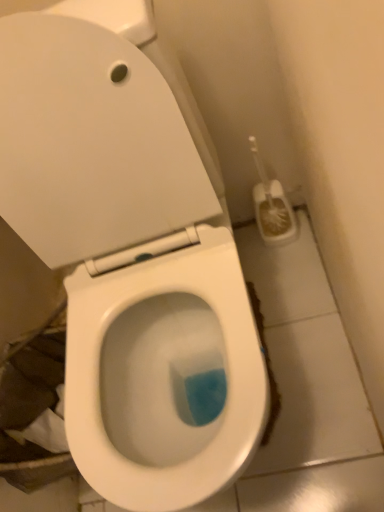
Question: Should I look upward or downward to see white plastic toilet brush at right?

Choices:
 (A) up
 (B) down

Answer: (A)

Question: Considering the relative sizes of white glossy toilet at center and white plastic toilet brush at right in the image provided, is white glossy toilet at center smaller than white plastic toilet brush at right?

Choices:
 (A) yes
 (B) no

Answer: (B)

Question: From the image's perspective, is white glossy toilet at center below white plastic toilet brush at right?

Choices:
 (A) no
 (B) yes

Answer: (B)

Question: Is white glossy toilet at center turned away from white plastic toilet brush at right?

Choices:
 (A) no
 (B) yes

Answer: (A)

Question: From a real-world perspective, does white glossy toilet at center sit lower than white plastic toilet brush at right?

Choices:
 (A) no
 (B) yes

Answer: (A)

Question: Can you confirm if white glossy toilet at center is wider than white plastic toilet brush at right?

Choices:
 (A) yes
 (B) no

Answer: (A)

Question: Does white glossy toilet at center have a greater height compared to white plastic toilet brush at right?

Choices:
 (A) no
 (B) yes

Answer: (B)

Question: Is white plastic toilet brush at right directly adjacent to white glossy toilet at center?

Choices:
 (A) no
 (B) yes

Answer: (A)

Question: Are white plastic toilet brush at right and white glossy toilet at center far apart?

Choices:
 (A) yes
 (B) no

Answer: (B)

Question: Is white glossy toilet at center inside white plastic toilet brush at right?

Choices:
 (A) no
 (B) yes

Answer: (A)

Question: From a real-world perspective, is white plastic toilet brush at right physically below white glossy toilet at center?

Choices:
 (A) no
 (B) yes

Answer: (B)

Question: Is white plastic toilet brush at right at the left side of white glossy toilet at center?

Choices:
 (A) yes
 (B) no

Answer: (B)

Question: From the image's perspective, is white plastic toilet brush at right on white glossy toilet at center?

Choices:
 (A) no
 (B) yes

Answer: (B)

Question: Relative to white glossy toilet at center, is white plastic toilet brush at right in front or behind?

Choices:
 (A) behind
 (B) front

Answer: (A)